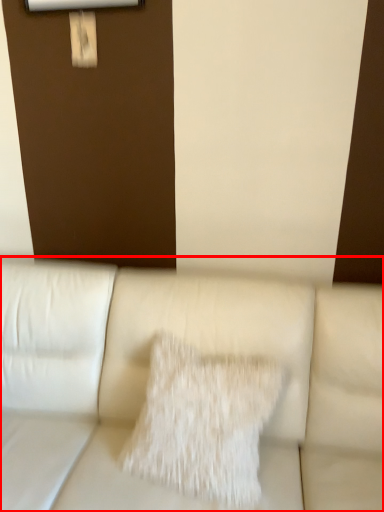
Question: Where is studio couch (annotated by the red box) located in relation to pillow in the image?

Choices:
 (A) left
 (B) right

Answer: (A)